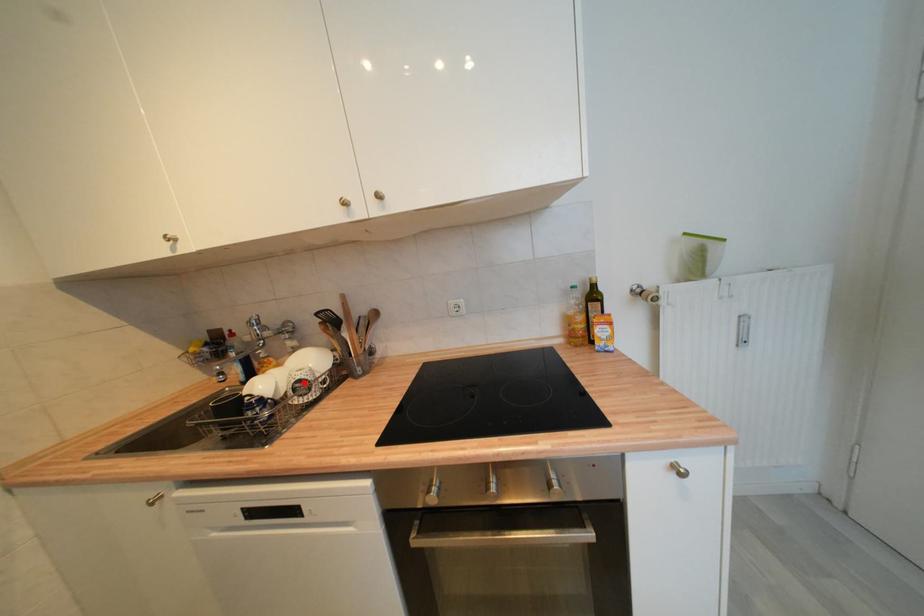
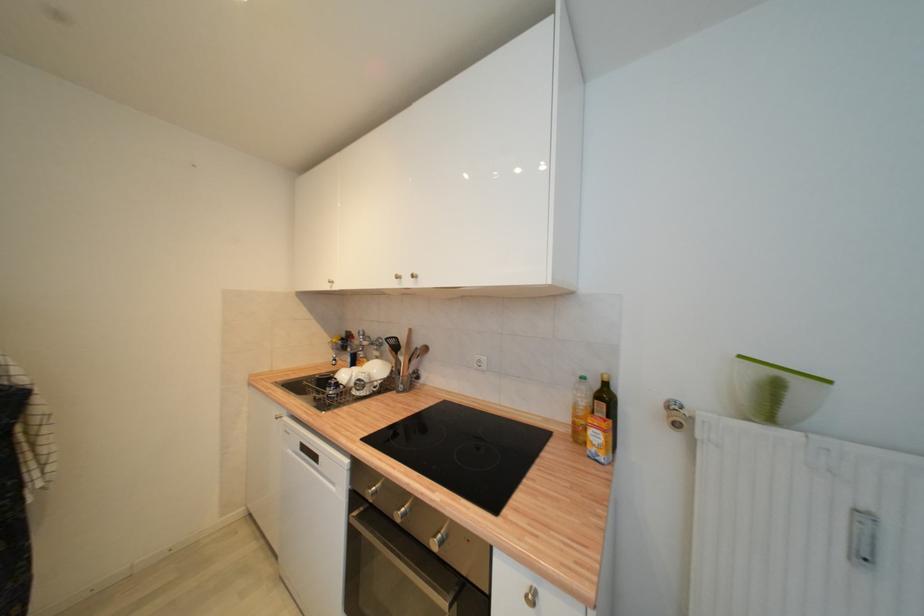
The point at the highlighted location is marked in the first image. Where is the corresponding point in the second image?

(363, 382)